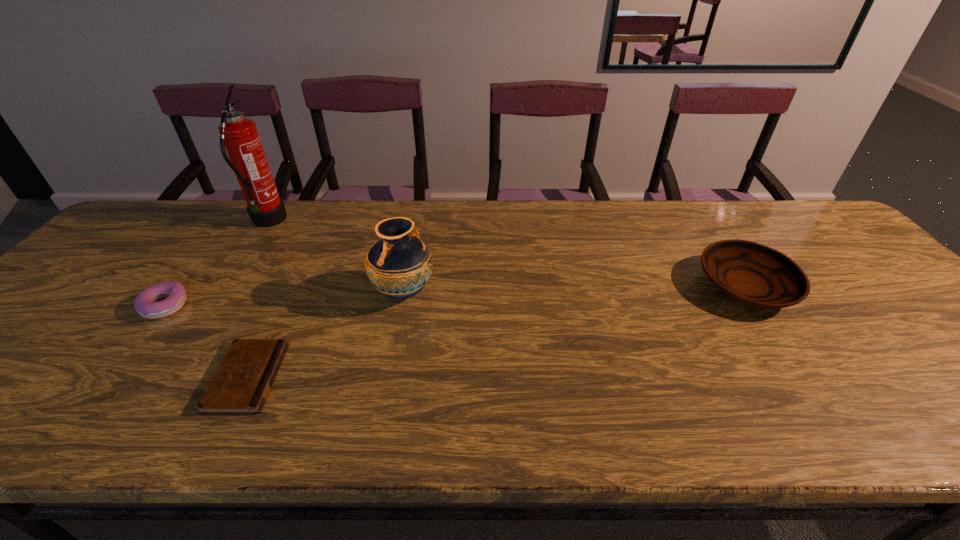
You are a GUI agent. You are given a task and a screenshot of the screen. Output one action in this format:
    pyautogui.click(x=<x>, y=<y>)
    Task: Click on the free region at the far left corner of the desktop
    The width and height of the screenshot is (960, 540).
    Given the screenshot: What is the action you would take?
    pyautogui.click(x=132, y=242)

In the image, there is a desktop. Where is `vacant space at the far right corner`? vacant space at the far right corner is located at coordinates (785, 202).

Where is `free space between the pottery and the fire extinguisher`? This screenshot has width=960, height=540. free space between the pottery and the fire extinguisher is located at coordinates (336, 257).

Locate an element on the screen. The width and height of the screenshot is (960, 540). unoccupied position between the third object from right to left and the second tallest object is located at coordinates (325, 335).

Identify the location of vacant region between the fourth shortest object and the pastry. (284, 299).

You are a GUI agent. You are given a task and a screenshot of the screen. Output one action in this format:
    pyautogui.click(x=<x>, y=<y>)
    Task: Click on the free space that is in between the fourth object from left to right and the second object from left to right
    This screenshot has width=960, height=540.
    Given the screenshot: What is the action you would take?
    pyautogui.click(x=336, y=257)

This screenshot has height=540, width=960. Find the location of `free space between the leftmost object and the nearest object`. free space between the leftmost object and the nearest object is located at coordinates (206, 341).

Where is `free space that is in between the second object from left to right and the rightmost object`? free space that is in between the second object from left to right and the rightmost object is located at coordinates (507, 254).

In order to click on free space that is in between the farthest object and the second object from right to left in this screenshot , I will do `click(336, 257)`.

Locate an element on the screen. unoccupied position between the rightmost object and the pottery is located at coordinates (575, 289).